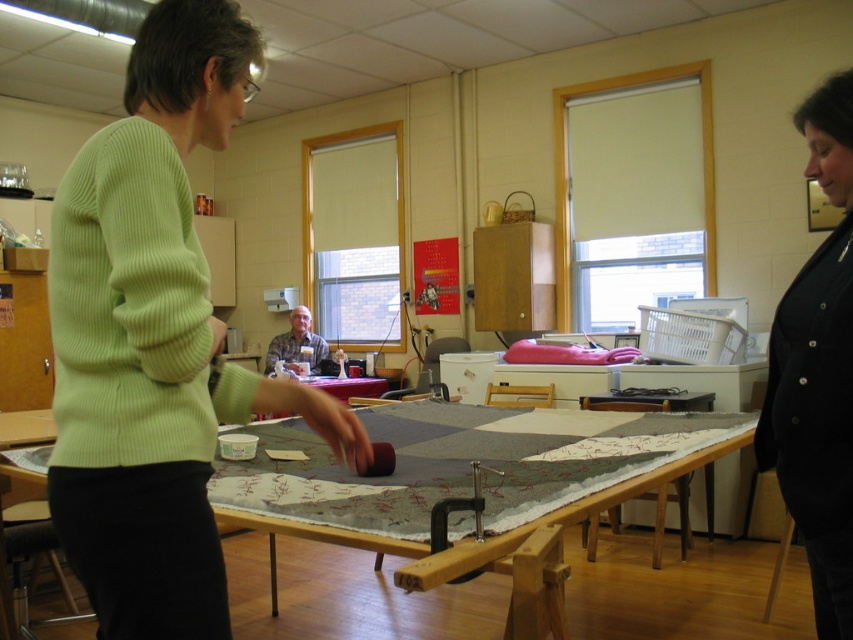
You are standing in the workshop and want to place a new sewing kit exactly at the center of the room. The room has a coordinate system where the bottom left corner is the origin point. Where should you place the sewing kit relative to the textured wool quilt at center?

The textured wool quilt at center is already positioned at the center coordinates of the room, so placing the sewing kit at the center would mean placing it directly on or near the textured wool quilt at center.

Based on the photo, you are organizing a craft fair and need to display the textured wool quilt at center and the gray fabric at center. Based on their positions in the image, which one is closer to the viewer?

The textured wool quilt at center is closer to the viewer than the gray fabric at center.

You are organizing a craft fair and need to arrange items from the image. If you want to place the green ribbed sweater at left and the gray fabric at center on a shelf, which one should you place first to ensure the sweater is above the fabric?

The green ribbed sweater at left should be placed first on the shelf so that it can be positioned above the gray fabric at center.